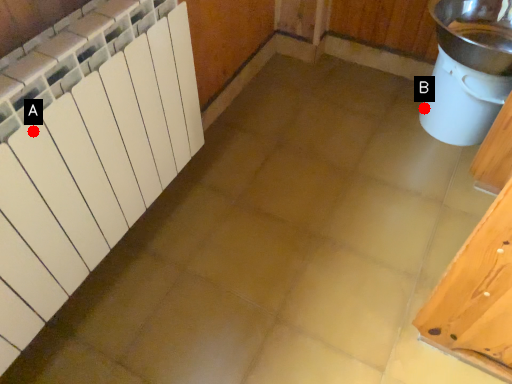
Question: Two points are circled on the image, labeled by A and B beside each circle. Which point is farther to the camera?

Choices:
 (A) A is further
 (B) B is further

Answer: (B)